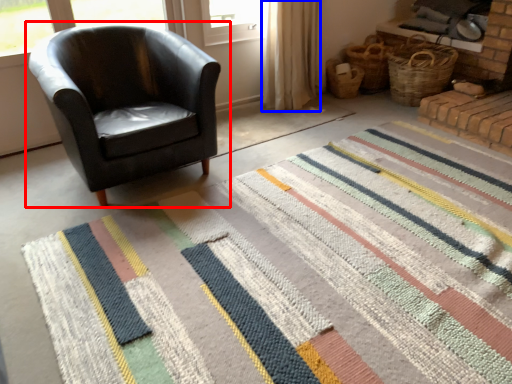
Question: Which of the following is the closest to the observer, chair (highlighted by a red box) or curtain (highlighted by a blue box)?

Choices:
 (A) chair
 (B) curtain

Answer: (A)